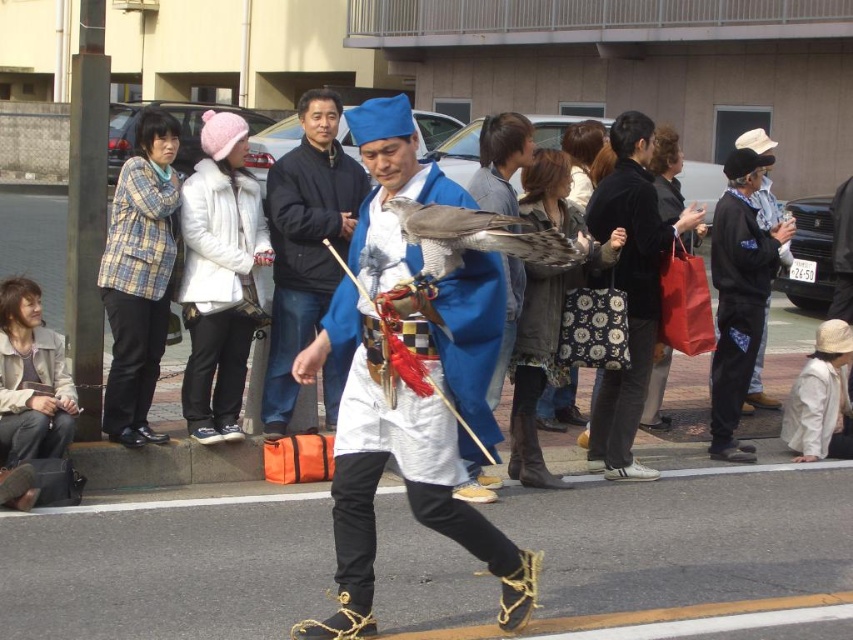
Question: Considering the real-world distances, which object is farthest from the white matte robe at center?

Choices:
 (A) blue silk kimono at center
 (B) leather jacket at lower left

Answer: (B)

Question: Which point is farther to the camera?

Choices:
 (A) (753, 369)
 (B) (100, 278)
 (C) (820, 449)

Answer: (A)

Question: Which object is closer to the camera taking this photo?

Choices:
 (A) white matte robe at center
 (B) white fur coat at upper left
 (C) blue silk robe at center

Answer: (B)

Question: Is white matte robe at center closer to the viewer compared to blue silk robe at center?

Choices:
 (A) no
 (B) yes

Answer: (A)

Question: Is blue fabric kimono at center wider than black fleece jacket at right?

Choices:
 (A) yes
 (B) no

Answer: (B)

Question: In this image, where is black fleece jacket at right located relative to leather jacket at lower left?

Choices:
 (A) left
 (B) right

Answer: (B)